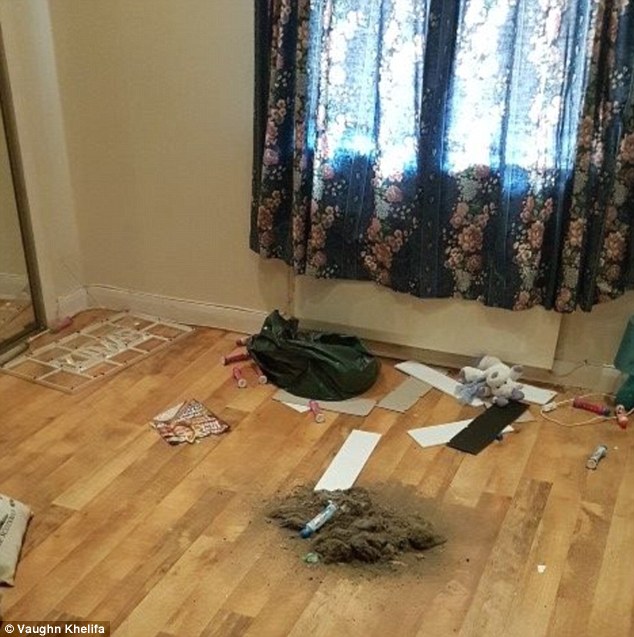
The height and width of the screenshot is (637, 634). In order to click on baseboard in this screenshot , I will do `click(236, 309)`, `click(74, 304)`, `click(598, 376)`.